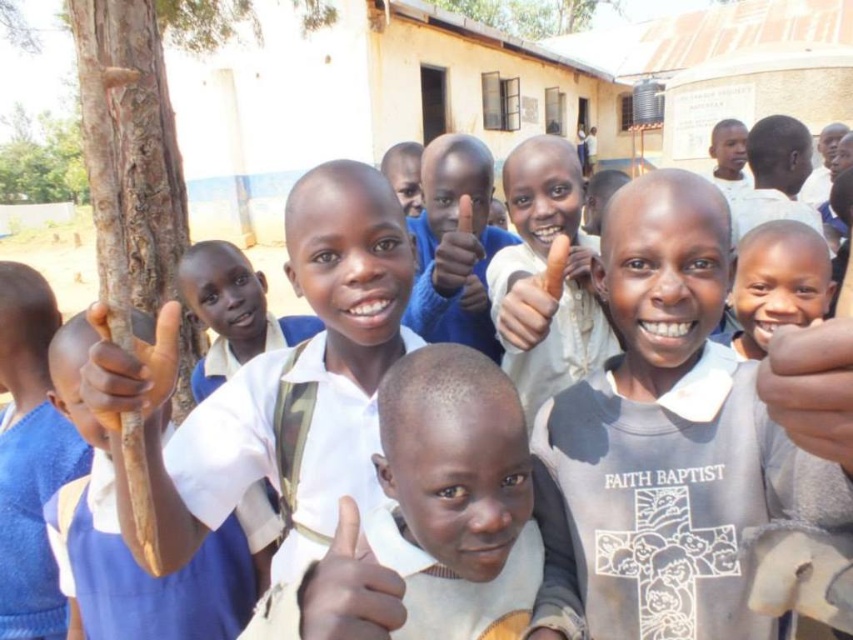
Does smooth white shirt at center appear over blue fabric shirt at left?

Yes.

Does smooth white shirt at center have a lesser width compared to blue fabric shirt at left?

Yes.

Find the location of a particular element. Image resolution: width=853 pixels, height=640 pixels. smooth white shirt at center is located at coordinates (456, 497).

Can you confirm if white matte shirt at center is taller than smooth skin hand at center?

Correct, white matte shirt at center is much taller as smooth skin hand at center.

Which is in front, point (608, 282) or point (782, 336)?

Point (782, 336)

Does point (643, 285) come behind point (843, 388)?

Yes.

Where is `white matte shirt at center`? The height and width of the screenshot is (640, 853). white matte shirt at center is located at coordinates (670, 440).

Does smooth skin hand at center have a lesser width compared to white matte hand at center?

In fact, smooth skin hand at center might be wider than white matte hand at center.

Which is more to the right, smooth skin hand at center or white matte hand at center?

smooth skin hand at center

Image resolution: width=853 pixels, height=640 pixels. What do you see at coordinates (811, 387) in the screenshot?
I see `smooth skin hand at center` at bounding box center [811, 387].

Identify the location of smooth skin hand at center. tap(811, 387).